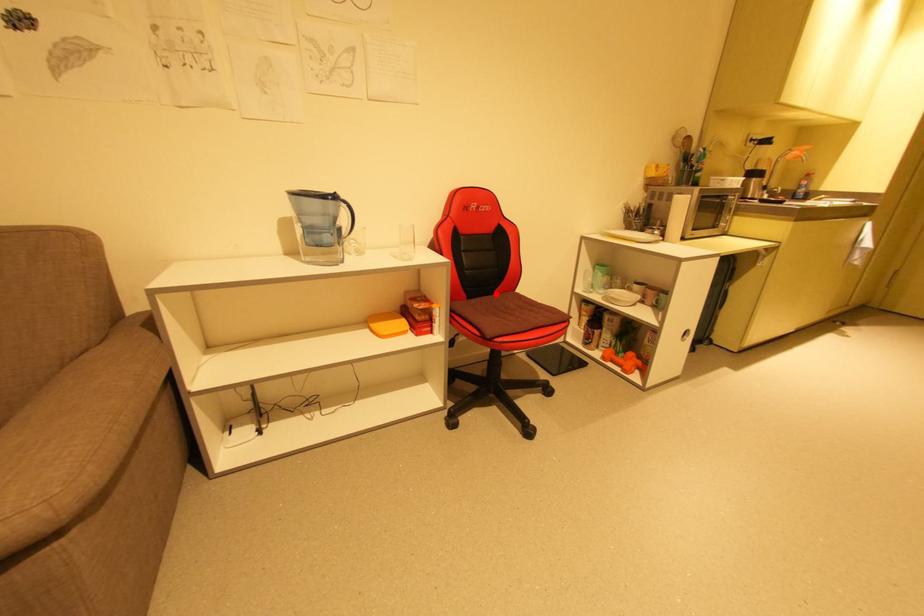
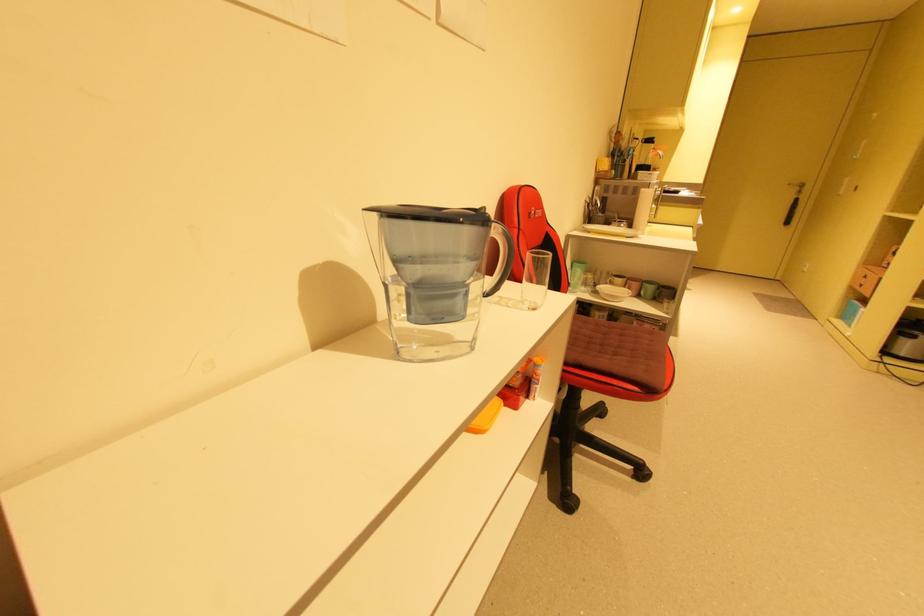
Question: I am providing you with two images of the same scene from different viewpoints. A red point is marked on the first image. Can you still see the location of the red point in image 2?

Choices:
 (A) Yes
 (B) No

Answer: (B)